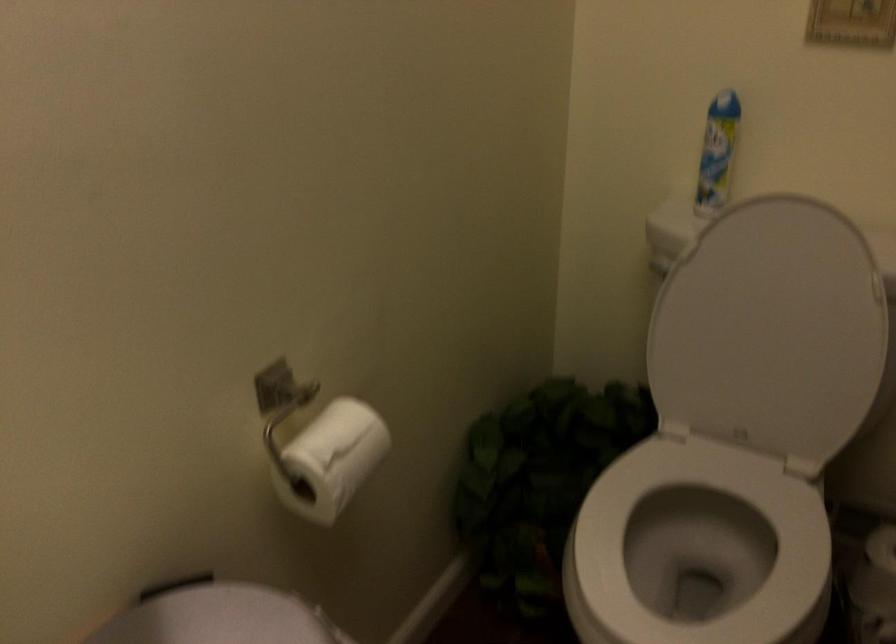
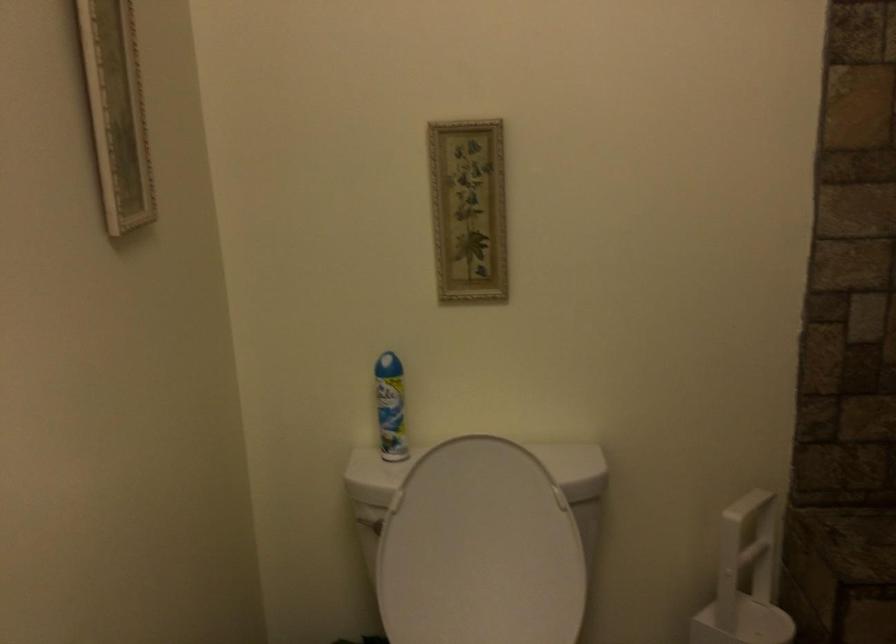
The point at [659,270] is marked in the first image. Where is the corresponding point in the second image?

(368, 522)